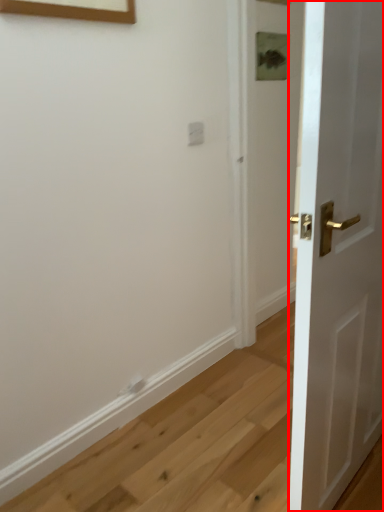
Question: From the image's perspective, what is the correct spatial relationship of door (annotated by the red box) in relation to electric outlet?

Choices:
 (A) below
 (B) above

Answer: (A)